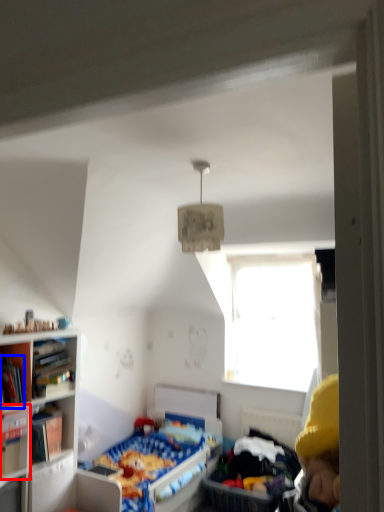
Question: Which point is further to the camera, book (highlighted by a red box) or book (highlighted by a blue box)?

Choices:
 (A) book
 (B) book

Answer: (B)